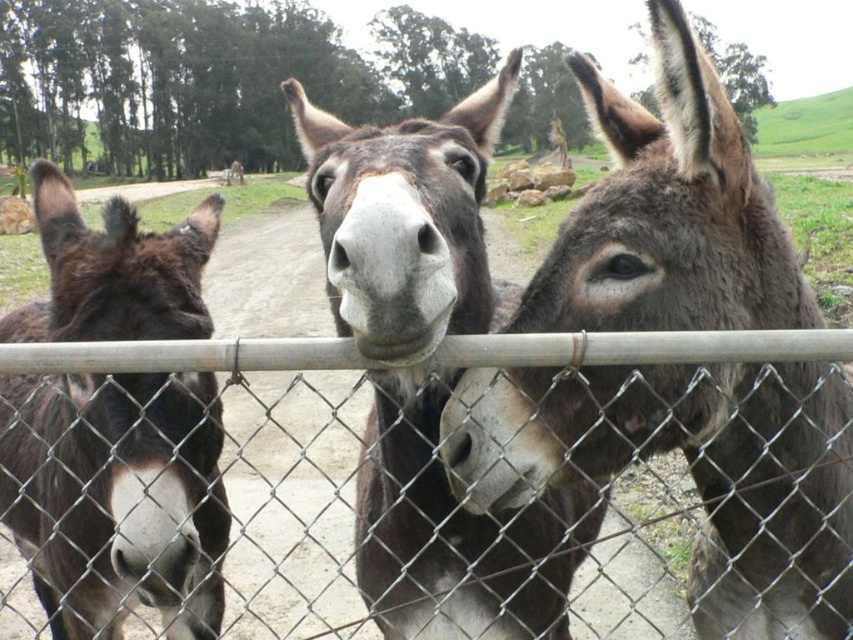
You are standing in front of the fence where the three donkeys are. You notice a specific point marked at coordinates point (631, 188). If you want to touch that point with a stick that is 1.2 meters long, can you reach it?

The point (631, 188) is 1.32 meters away from the viewer. Since the stick is only 1.2 meters long, you cannot reach the point with the stick.

You are standing at the point marked by coordinates point (x=405, y=220) in the image. What color do you see around you?

The point (x=405, y=220) corresponds to dark brown fur at center.